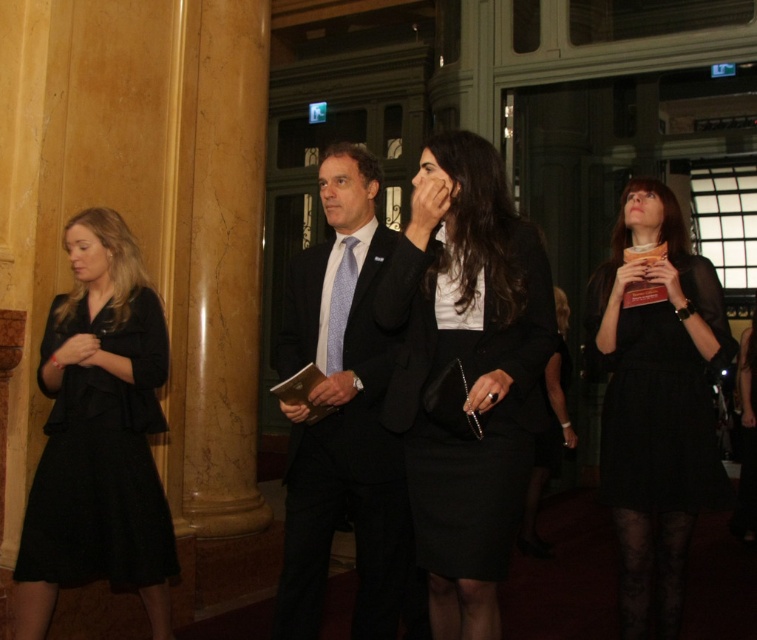
You are a photographer at this event and need to position two subjects for a photo. The subjects are wearing the matte black suit at center and the black satin dress at right. Which subject should you move closer to the camera to ensure both appear the same size in the photo?

You should move the black satin dress at right closer to the camera because the matte black suit at center is bigger in size, so bringing the smaller black satin dress at right forward will balance their apparent sizes in the photo.

You are standing at the origin point in the image and want to move towards the point at the bottom right corner. Which point, point (460,596) or point (111,570), is closer to your current position?

Point (460,596) is closer to your current position because it is in front of point (111,570).